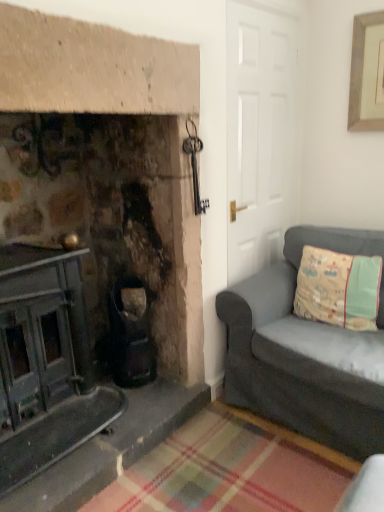
Question: Is beige fabric pillow at right at the right side of dark gray fabric couch at right?

Choices:
 (A) yes
 (B) no

Answer: (A)

Question: From a real-world perspective, is beige fabric pillow at right over dark gray fabric couch at right?

Choices:
 (A) no
 (B) yes

Answer: (B)

Question: From the image's perspective, does beige fabric pillow at right appear lower than dark gray fabric couch at right?

Choices:
 (A) no
 (B) yes

Answer: (A)

Question: Does beige fabric pillow at right come behind dark gray fabric couch at right?

Choices:
 (A) yes
 (B) no

Answer: (A)

Question: Are beige fabric pillow at right and dark gray fabric couch at right beside each other?

Choices:
 (A) yes
 (B) no

Answer: (B)

Question: Is beige fabric pillow at right wider than dark gray fabric couch at right?

Choices:
 (A) yes
 (B) no

Answer: (B)

Question: Is dark gray fabric couch at right aimed at beige fabric pillow at right?

Choices:
 (A) no
 (B) yes

Answer: (B)

Question: Is dark gray fabric couch at right closer to camera compared to beige fabric pillow at right?

Choices:
 (A) yes
 (B) no

Answer: (A)

Question: Does dark gray fabric couch at right have a lesser width compared to beige fabric pillow at right?

Choices:
 (A) no
 (B) yes

Answer: (A)

Question: Is dark gray fabric couch at right facing away from beige fabric pillow at right?

Choices:
 (A) yes
 (B) no

Answer: (A)

Question: From the image's perspective, is dark gray fabric couch at right below beige fabric pillow at right?

Choices:
 (A) no
 (B) yes

Answer: (B)

Question: Considering the relative sizes of dark gray fabric couch at right and beige fabric pillow at right in the image provided, is dark gray fabric couch at right wider than beige fabric pillow at right?

Choices:
 (A) no
 (B) yes

Answer: (B)

Question: Would you say beige fabric pillow at right is to the left or to the right of dark gray fabric couch at right in the picture?

Choices:
 (A) right
 (B) left

Answer: (A)